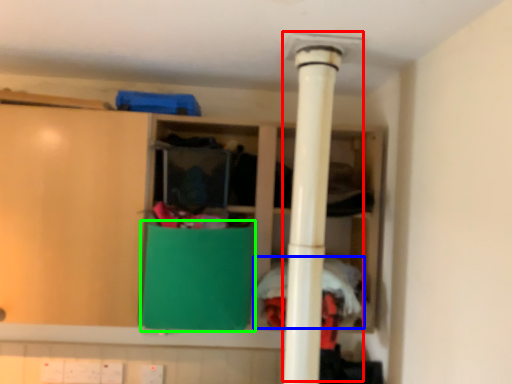
Question: Which is farther away from water heater (highlighted by a red box)? clothing (highlighted by a blue box) or cabinetry (highlighted by a green box)?

Choices:
 (A) clothing
 (B) cabinetry

Answer: (A)